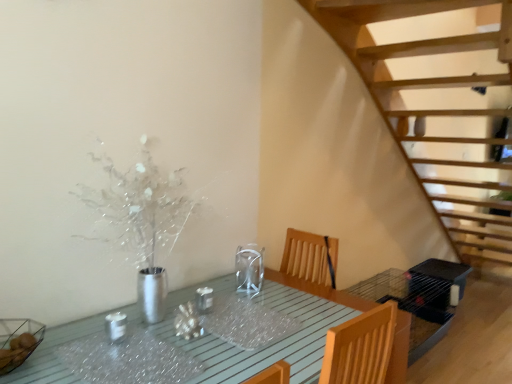
The image size is (512, 384). I want to click on free point above clear glass table at center (from a real-world perspective), so click(179, 331).